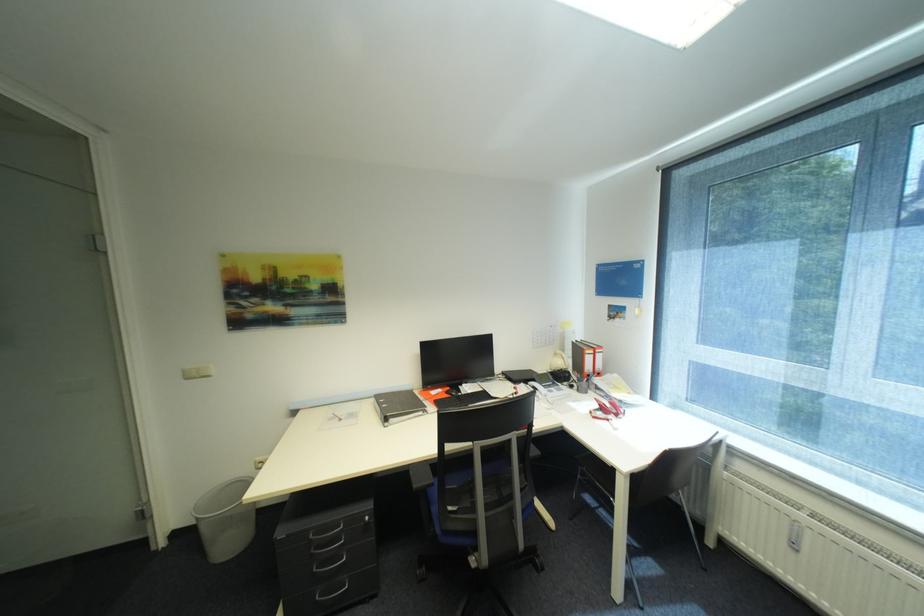
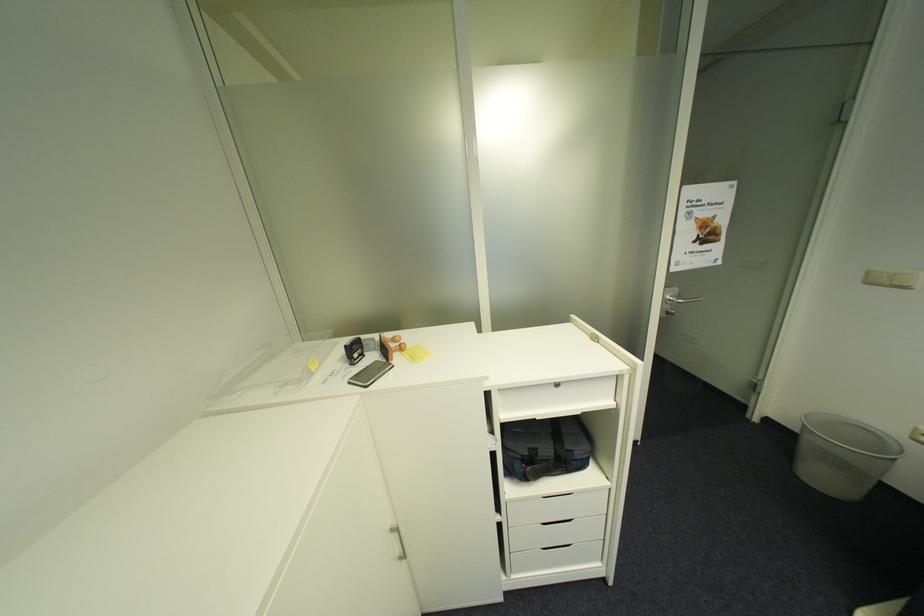
Locate, in the second image, the point that corresponds to (x=201, y=524) in the first image.

(805, 429)